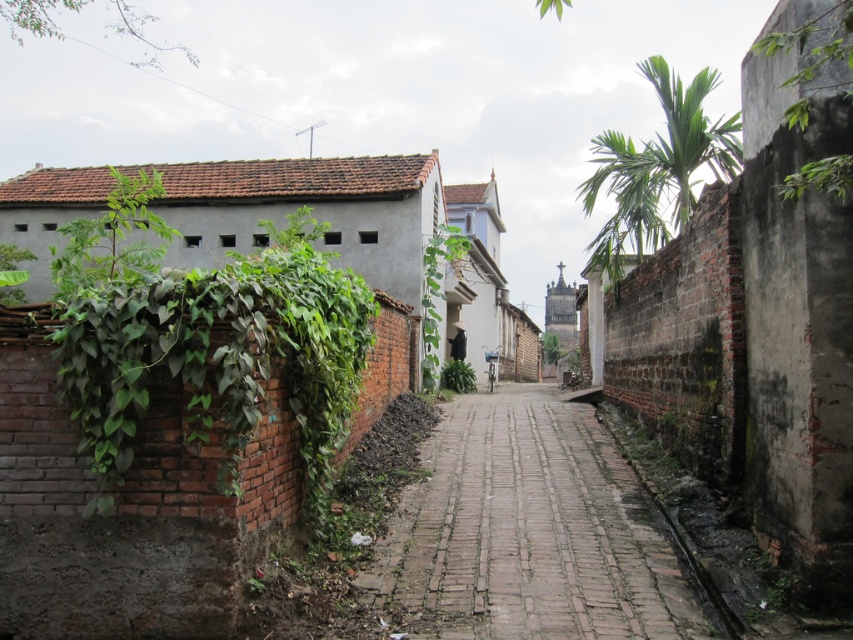
You are a gardener who needs to water both the green leafy vines at left and the green leafy plant at center. Given that your watering can holds enough water for 30 feet of travel, can you water both without refilling?

The green leafy vines at left and green leafy plant at center are 28.12 feet apart, so yes, you can water both without needing to refill your watering can since the distance between them is within the 30 feet capacity.

You are a delivery person trying to navigate through the narrow alleyway. You see the brick paved path at center and the green leafy plant at center. Which object is located to the right of the other?

The brick paved path at center is positioned on the right side of green leafy plant at center, so the brick paved path at center is to the right of the green leafy plant at center.

Consider the image. You are a delivery drone flying over an alleyway. You need to land precisely at the coordinates provided in the image. Can you confirm if the green leafy palm at upper right is located at the coordinates given?

Yes, the green leafy palm at upper right is located at the coordinates point (657, 168), so it is correctly positioned there.